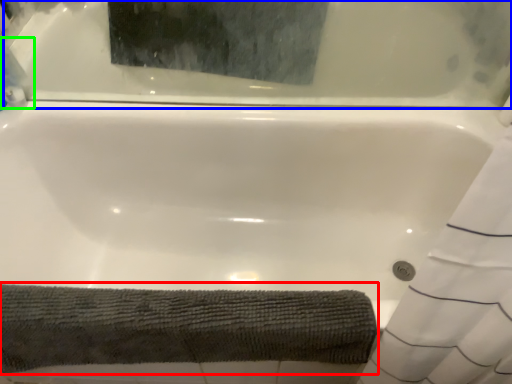
Question: Which object is the farthest from bath towel (highlighted by a red box)? Choose among these: bathtub (highlighted by a blue box) or cleaning product (highlighted by a green box).

Choices:
 (A) bathtub
 (B) cleaning product

Answer: (B)